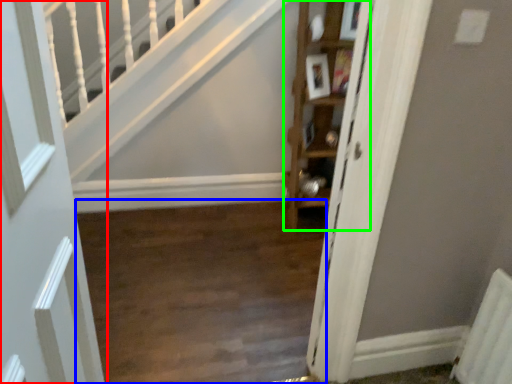
Question: Based on their relative distances, which object is nearer to door (highlighted by a red box)? Choose from corridor (highlighted by a blue box) and cabinet (highlighted by a green box).

Choices:
 (A) corridor
 (B) cabinet

Answer: (A)